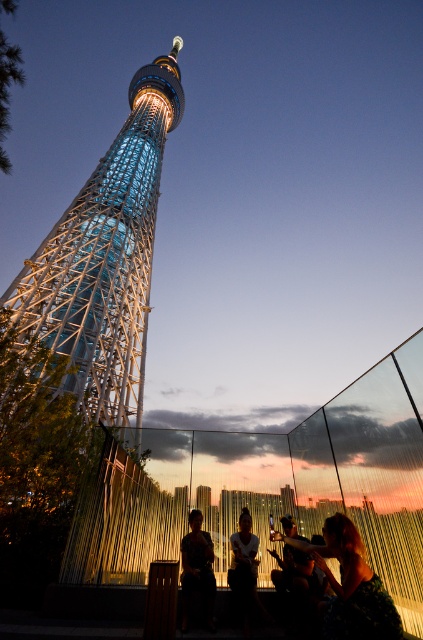
Which is more to the right, shiny metallic tower at center or silhouette fabric at center?

From the viewer's perspective, silhouette fabric at center appears more on the right side.

How far apart are shiny metallic tower at center and silhouette fabric at center?

shiny metallic tower at center is 69.73 meters away from silhouette fabric at center.

Between point (82, 371) and point (246, 531), which one is positioned in front?

Point (246, 531)

Where is `shiny metallic tower at center`? The height and width of the screenshot is (640, 423). shiny metallic tower at center is located at coordinates (106, 257).

Is silhouette fabric at lower center closer to the viewer compared to silhouette fabric at center?

Yes, it is in front of silhouette fabric at center.

Is silhouette fabric at lower center further to camera compared to silhouette fabric at center?

No, silhouette fabric at lower center is in front of silhouette fabric at center.

Which is in front, point (211, 545) or point (255, 552)?

Point (255, 552)

Locate an element on the screen. The width and height of the screenshot is (423, 640). silhouette fabric at lower center is located at coordinates pyautogui.click(x=197, y=570).

Is point (343, 620) farther from viewer compared to point (247, 540)?

No, (343, 620) is in front of (247, 540).

Does dark brown hair at center come behind silhouette fabric at center?

No, dark brown hair at center is closer to the viewer.

Is point (343, 518) positioned after point (247, 508)?

No.

I want to click on dark brown hair at center, so click(351, 586).